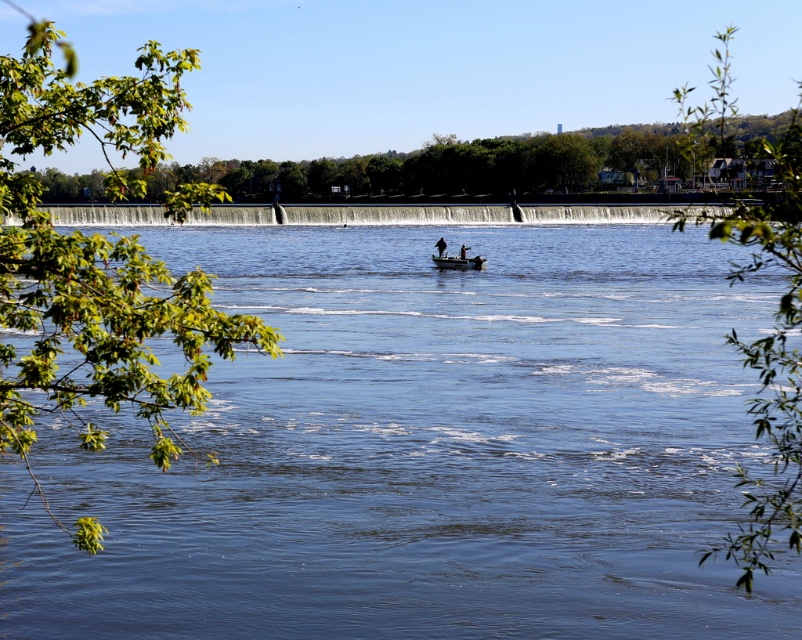
Question: Among these points, which one is nearest to the camera?

Choices:
 (A) (543, 164)
 (B) (444, 257)
 (C) (768, 156)

Answer: (B)

Question: Is green leafy branch at left to the left of matte black boat at center from the viewer's perspective?

Choices:
 (A) yes
 (B) no

Answer: (A)

Question: Which point is farther to the camera?

Choices:
 (A) (438, 243)
 (B) (435, 260)

Answer: (A)

Question: Is green leafy branch at left further to camera compared to green leafy branch at upper right?

Choices:
 (A) no
 (B) yes

Answer: (B)

Question: Where is blue water at center located in relation to matte black canoe at center in the image?

Choices:
 (A) right
 (B) left

Answer: (B)

Question: Which point appears farthest from the camera in this image?

Choices:
 (A) (464, 257)
 (B) (649, 156)
 (C) (10, 3)
 (D) (440, 253)

Answer: (C)